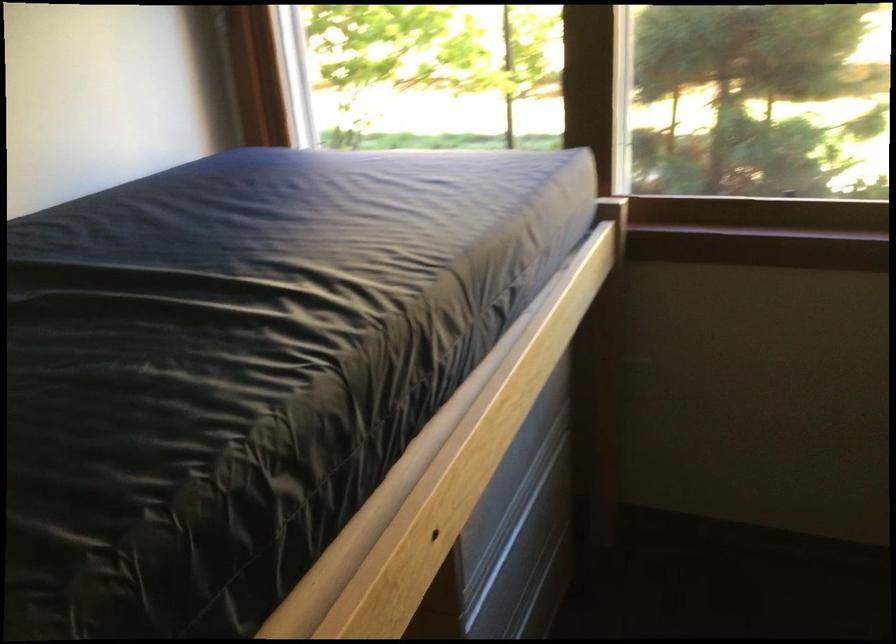
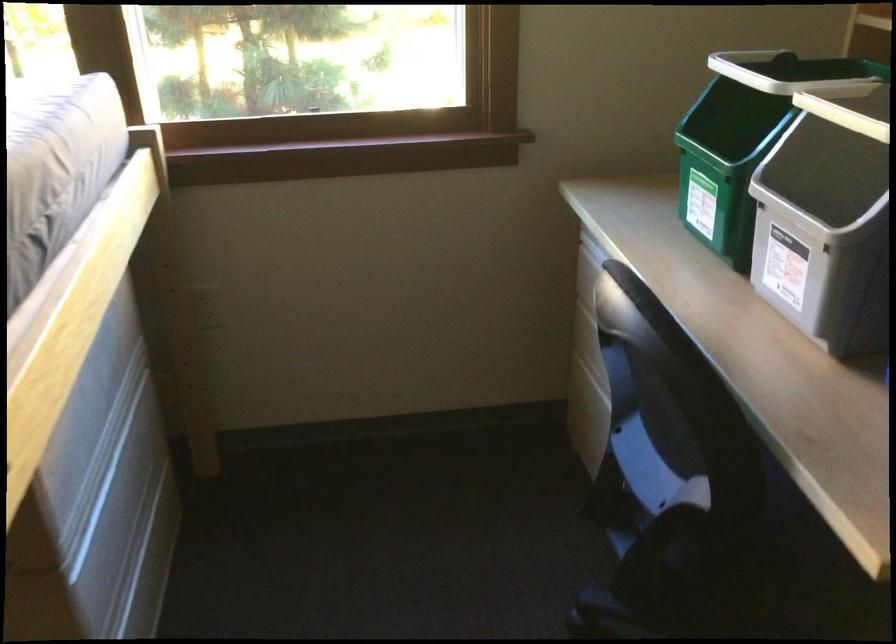
Question: The first image is from the beginning of the video and the second image is from the end. How did the camera likely rotate when shooting the video?

Choices:
 (A) Left
 (B) Right
 (C) Up
 (D) Down

Answer: (B)